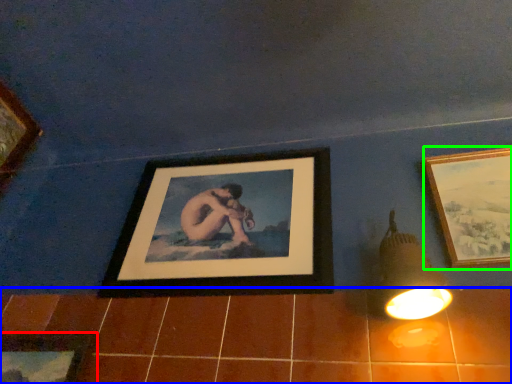
Question: Which object is the farthest from picture frame (highlighted by a red box)? Choose among these: ceramic tile (highlighted by a blue box) or picture frame (highlighted by a green box).

Choices:
 (A) ceramic tile
 (B) picture frame

Answer: (B)